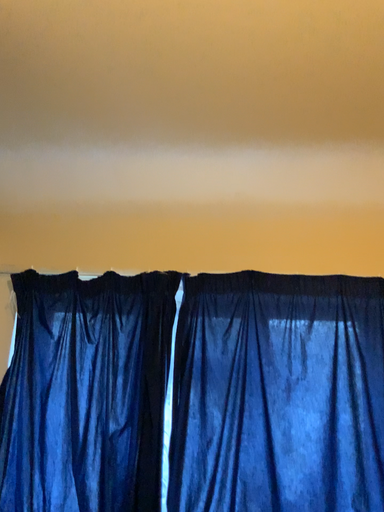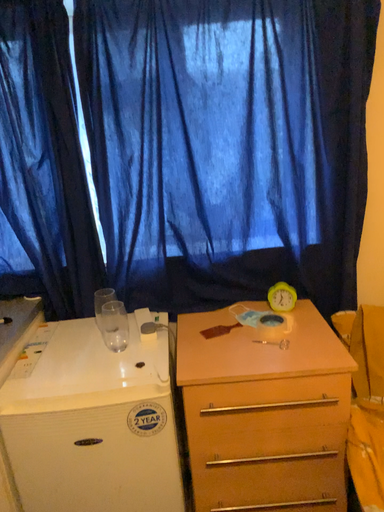
Question: How did the camera likely rotate when shooting the video?

Choices:
 (A) rotated downward
 (B) rotated upward

Answer: (A)